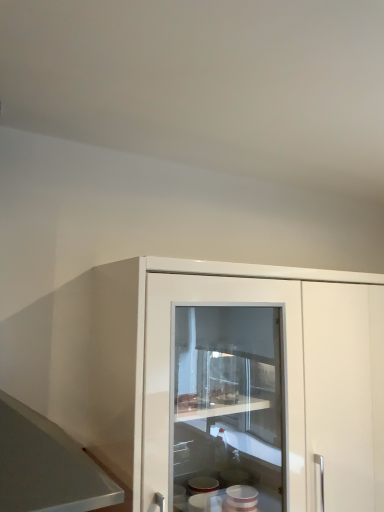
What do you see at coordinates (239, 379) in the screenshot? I see `white glossy cabinet at center` at bounding box center [239, 379].

What are the coordinates of `white glossy cabinet at center` in the screenshot? It's located at (239, 379).

Identify the location of white glossy cabinet at center. (239, 379).